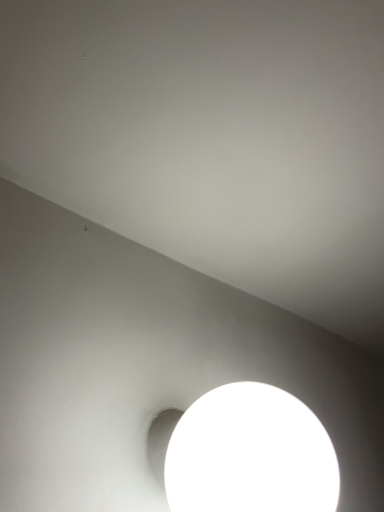
What is the approximate height of white glossy sphere at lower center?

The height of white glossy sphere at lower center is 16.06 centimeters.

This screenshot has height=512, width=384. What are the coordinates of `white glossy sphere at lower center` in the screenshot? It's located at (250, 454).

What do you see at coordinates (250, 454) in the screenshot? The height and width of the screenshot is (512, 384). I see `white glossy sphere at lower center` at bounding box center [250, 454].

The height and width of the screenshot is (512, 384). Identify the location of white glossy sphere at lower center. (250, 454).